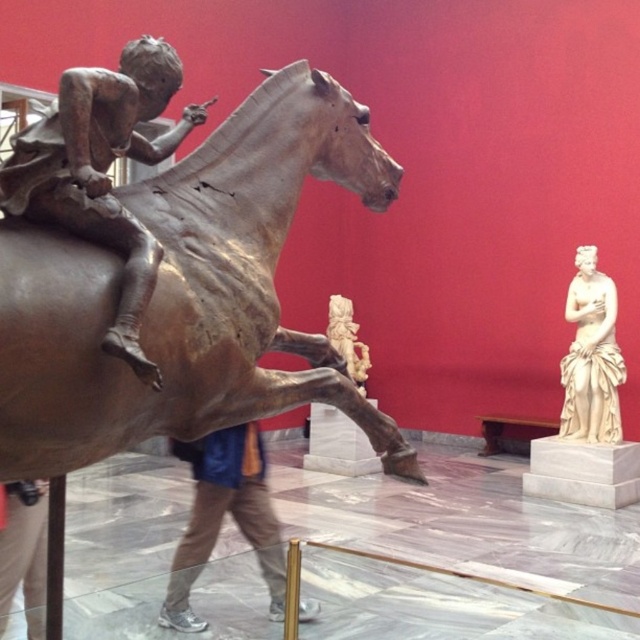
You are a visitor standing in front of the museum display. You notice the bronze metallic horse at center and the blue denim jeans at center. Which object is positioned closer to you?

The bronze metallic horse at center is closer to the viewer than the blue denim jeans at center.

You are a visitor standing in front of the museum display. You notice the bronze metallic horse at center and the brushed metal figure at lower left. Which object is closer to you?

The bronze metallic horse at center is closer to you because it is in front of the brushed metal figure at lower left.